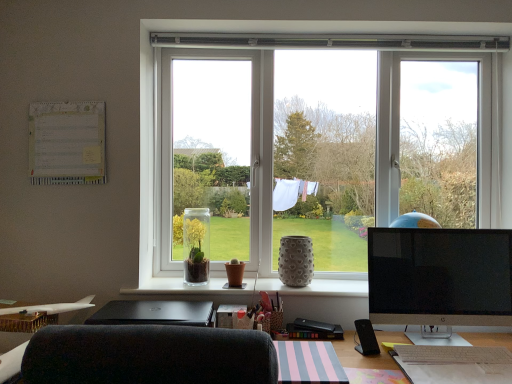
In order to click on vacant area to the right of brown matte vase at center, the second vase positioned from the right in this screenshot , I will do `click(266, 284)`.